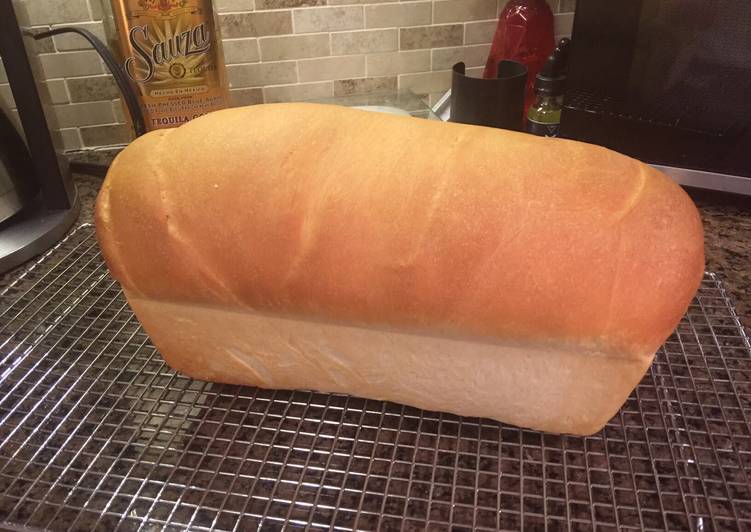
Image resolution: width=751 pixels, height=532 pixels. I want to click on backsplash, so click(x=324, y=51).